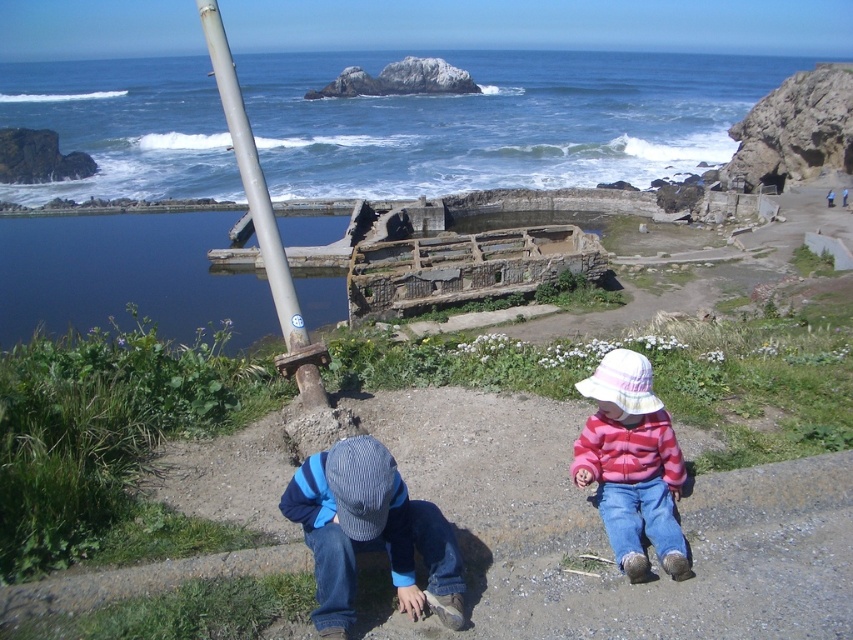
Question: Which point is closer to the camera?

Choices:
 (A) smooth dirt path at center
 (B) blue water at upper center

Answer: (A)

Question: Does smooth dirt path at center have a greater width compared to pink fleece jacket at lower right?

Choices:
 (A) yes
 (B) no

Answer: (A)

Question: Among these objects, which one is farthest from the camera?

Choices:
 (A) blue denim jeans at lower center
 (B) silver metallic pole at upper left

Answer: (B)

Question: Can you confirm if blue water at upper center is positioned above silver metallic pole at upper left?

Choices:
 (A) yes
 (B) no

Answer: (A)

Question: Among these points, which one is farthest from the camera?

Choices:
 (A) (666, 172)
 (B) (248, 141)

Answer: (A)

Question: Can you confirm if blue denim jeans at lower center is positioned to the left of silver metallic pole at upper left?

Choices:
 (A) yes
 (B) no

Answer: (B)